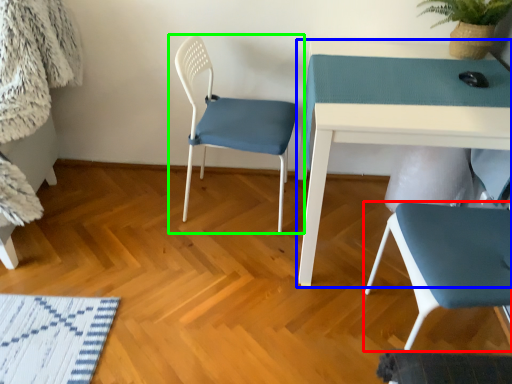
Question: Which object is the farthest from chair (highlighted by a red box)? Choose among these: table (highlighted by a blue box) or chair (highlighted by a green box).

Choices:
 (A) table
 (B) chair

Answer: (B)